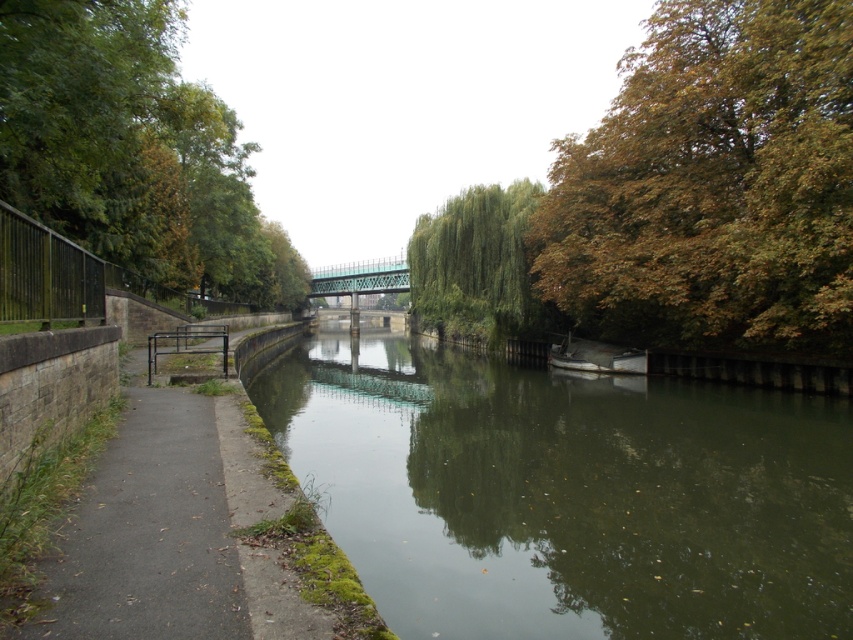
You are standing at the center of the small bridge in the canal scene. Looking towards the upper right corner of the image, can you see the brown leafy tree at upper right? Please explain its position relative to the bridge.

Yes, the brown leafy tree at upper right is located at coordinates point [712,182], which places it in the upper right corner of the image. From the center of the bridge, it would be visible in the upper right direction, positioned above and to the right of the bridge.